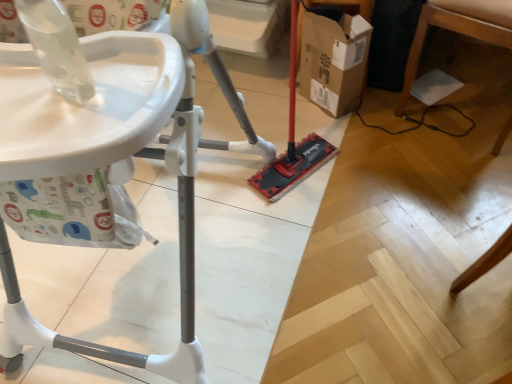
Question: Based on their sizes in the image, would you say white plastic high chair at left, the second furniture positioned from the right, is bigger or smaller than cardboard box at center?

Choices:
 (A) big
 (B) small

Answer: (A)

Question: Is white plastic high chair at left, which appears as the 1th furniture when viewed from the left, wider or thinner than cardboard box at center?

Choices:
 (A) thin
 (B) wide

Answer: (B)

Question: Which object is positioned farthest from the cardboard box at center?

Choices:
 (A) wooden table leg at lower right, which is counted as the 2th furniture, starting from the left
 (B) white plastic high chair at left, which appears as the 1th furniture when viewed from the left

Answer: (B)

Question: Which is nearer to the white plastic high chair at left, which appears as the 1th furniture when viewed from the left?

Choices:
 (A) wooden table leg at lower right, the 1th furniture positioned from the right
 (B) cardboard box at center

Answer: (B)